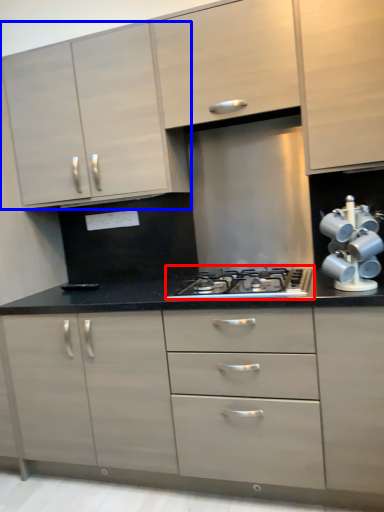
Question: Which object is further to the camera taking this photo, gas stove (highlighted by a red box) or cabinetry (highlighted by a blue box)?

Choices:
 (A) gas stove
 (B) cabinetry

Answer: (B)